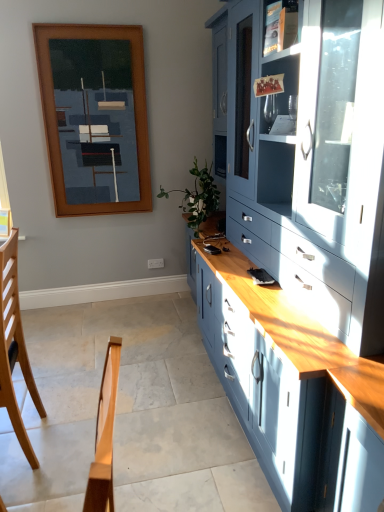
This screenshot has width=384, height=512. What are the coordinates of `free point above wooden picture frame at upper left (from a real-world perspective)` in the screenshot? It's located at (88, 18).